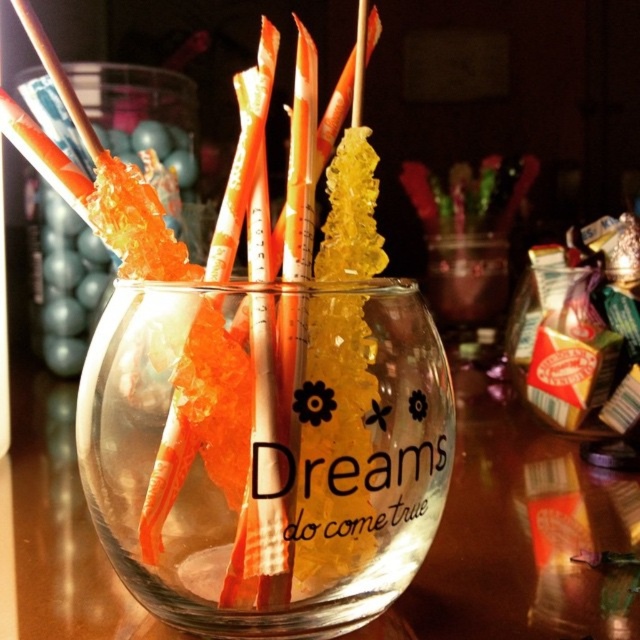
Which is behind, point (259, 380) or point (250, 156)?

The point (250, 156) is behind.

Who is higher up, transparent glass vase at center or translucent paper straw at center?

translucent paper straw at center

Is point (440, 442) more distant than point (145, 552)?

Yes, point (440, 442) is farther from viewer.

Identify the location of transparent glass vase at center. This screenshot has height=640, width=640. (269, 449).